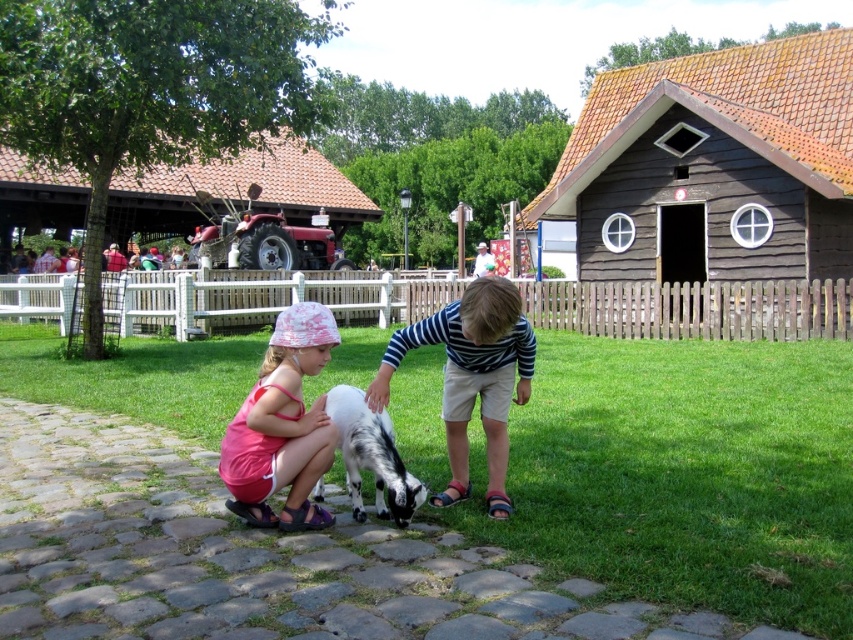
Does green grass at center have a greater height compared to white soft fur goat at center?

Yes.

Identify the location of green grass at center. The width and height of the screenshot is (853, 640). (688, 474).

The width and height of the screenshot is (853, 640). In order to click on green grass at center in this screenshot , I will do `click(688, 474)`.

Is brown wooden hut at upper right bigger than pink fabric hat at lower left?

Yes, brown wooden hut at upper right is bigger than pink fabric hat at lower left.

Does brown wooden hut at upper right lie in front of pink fabric hat at lower left?

No, brown wooden hut at upper right is further to the viewer.

The width and height of the screenshot is (853, 640). What do you see at coordinates (712, 164) in the screenshot?
I see `brown wooden hut at upper right` at bounding box center [712, 164].

At what (x,y) coordinates should I click in order to perform the action: click on brown wooden hut at upper right. Please return your answer as a coordinate pair (x, y). Looking at the image, I should click on (712, 164).

Does green grass at center lie in front of pink fabric hat at lower left?

Yes, green grass at center is closer to the viewer.

Which is above, green grass at center or pink fabric hat at lower left?

pink fabric hat at lower left is above.

Is point (766, 353) in front of point (294, 337)?

No, (766, 353) is behind (294, 337).

Locate an element on the screen. green grass at center is located at coordinates (688, 474).